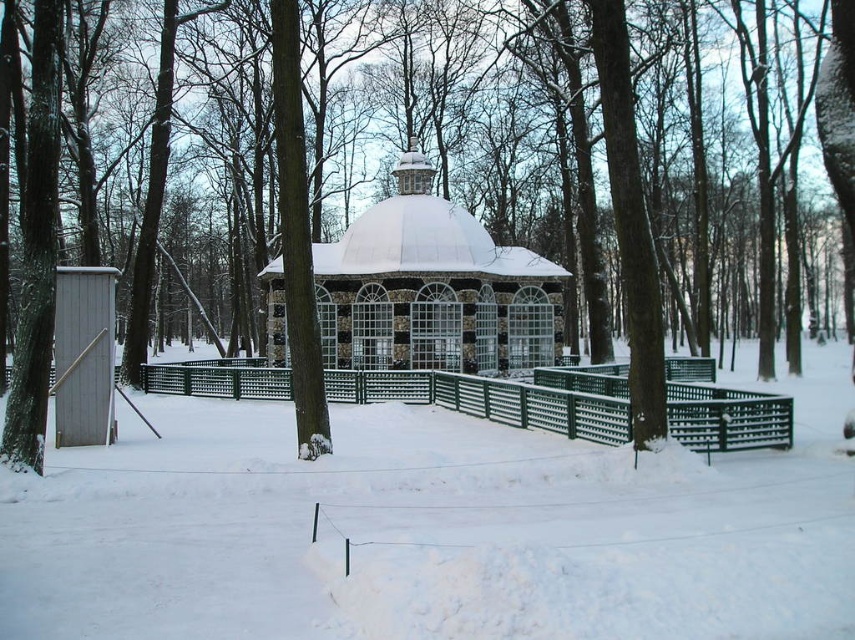
Question: Which of the following is the farthest from the observer?

Choices:
 (A) brown textured tree at center
 (B) white fluffy snow at center

Answer: (A)

Question: Does white fluffy snow at center have a greater width compared to green metal fence at center?

Choices:
 (A) yes
 (B) no

Answer: (A)

Question: Which point is closer to the camera?

Choices:
 (A) white fluffy snow at center
 (B) brown textured tree at center
 (C) snow-covered stone gazebo at center

Answer: (A)

Question: Which object is closer to the camera taking this photo?

Choices:
 (A) white fluffy snow at center
 (B) green metal fence at center

Answer: (A)

Question: Is white fluffy snow at center to the left of green metal fence at center from the viewer's perspective?

Choices:
 (A) no
 (B) yes

Answer: (A)

Question: Does snow-covered stone gazebo at center appear over green metal fence at center?

Choices:
 (A) no
 (B) yes

Answer: (B)